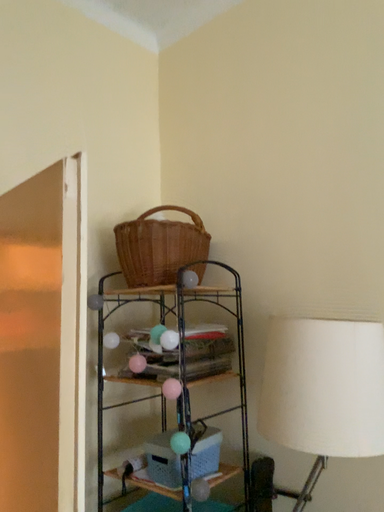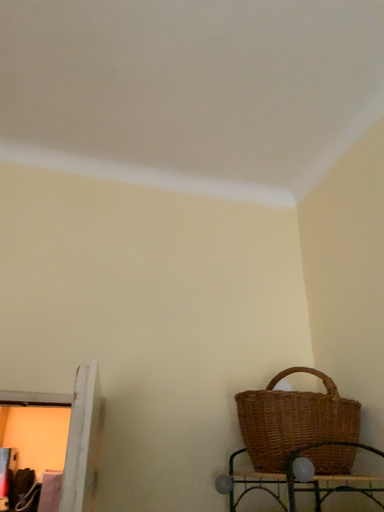
Question: Which way did the camera rotate in the video?

Choices:
 (A) rotated right
 (B) rotated left

Answer: (B)